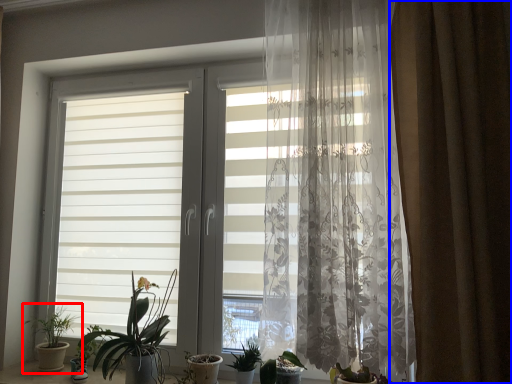
Question: Which point is further to the camera, houseplant (highlighted by a red box) or curtain (highlighted by a blue box)?

Choices:
 (A) houseplant
 (B) curtain

Answer: (A)